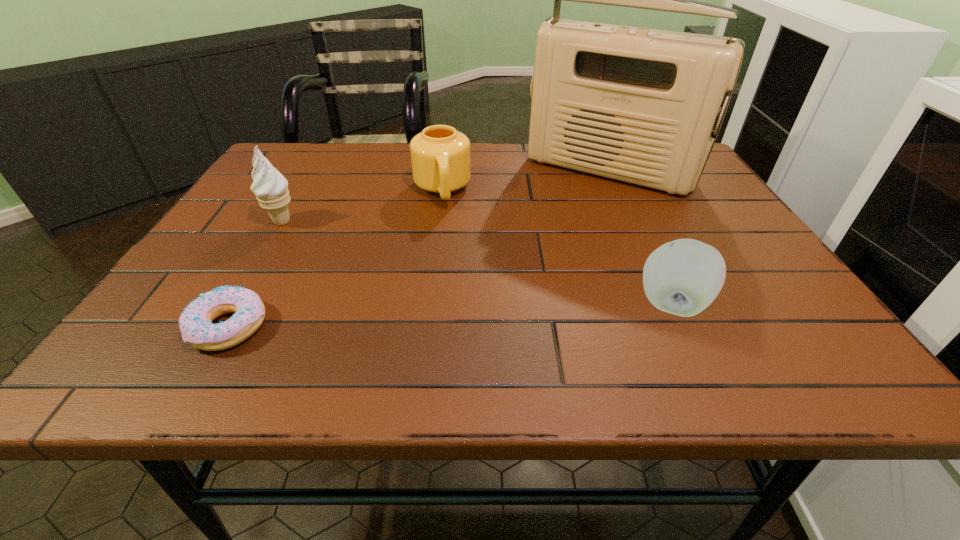
In order to click on apple present at the near edge in this screenshot , I will do `click(683, 277)`.

Identify the location of doughnut that is at the left edge. (195, 323).

Identify the location of icecream located at the left edge. The height and width of the screenshot is (540, 960). (270, 187).

Locate an element on the screen. object at the right edge is located at coordinates (638, 105).

Find the location of a particular element. Image resolution: width=960 pixels, height=540 pixels. object that is at the near left corner is located at coordinates [x=195, y=323].

Find the location of a particular element. This screenshot has width=960, height=540. object that is at the far right corner is located at coordinates (638, 105).

Where is `free spot at the far edge of the desktop`? This screenshot has height=540, width=960. free spot at the far edge of the desktop is located at coordinates [x=477, y=179].

The height and width of the screenshot is (540, 960). In order to click on blank space at the near edge of the desktop in this screenshot , I will do `click(636, 329)`.

At what (x,y) coordinates should I click in order to perform the action: click on vacant area at the left edge. Please return your answer as a coordinate pair (x, y). This screenshot has width=960, height=540. Looking at the image, I should click on (198, 285).

In the image, there is a desktop. What are the coordinates of `blank space at the right edge` in the screenshot? It's located at (723, 230).